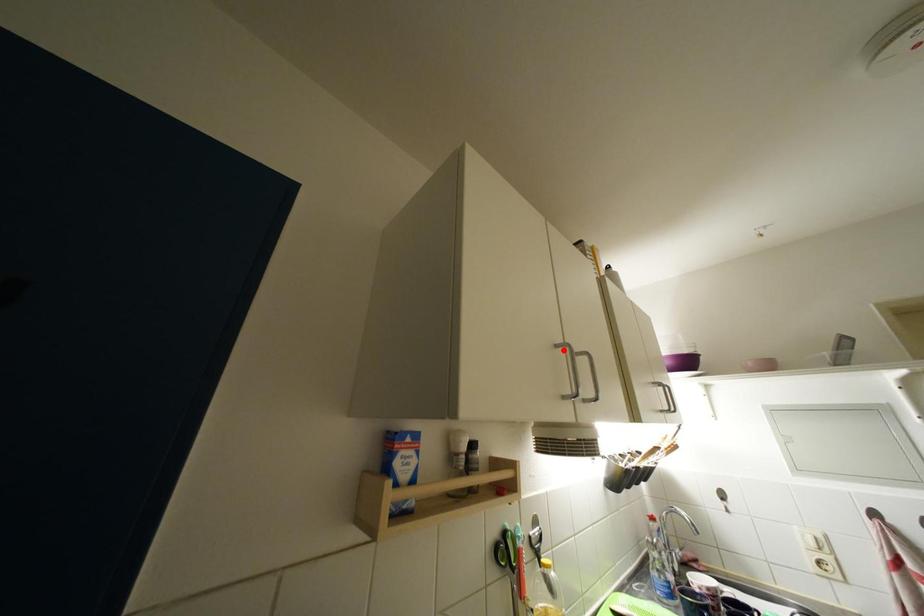
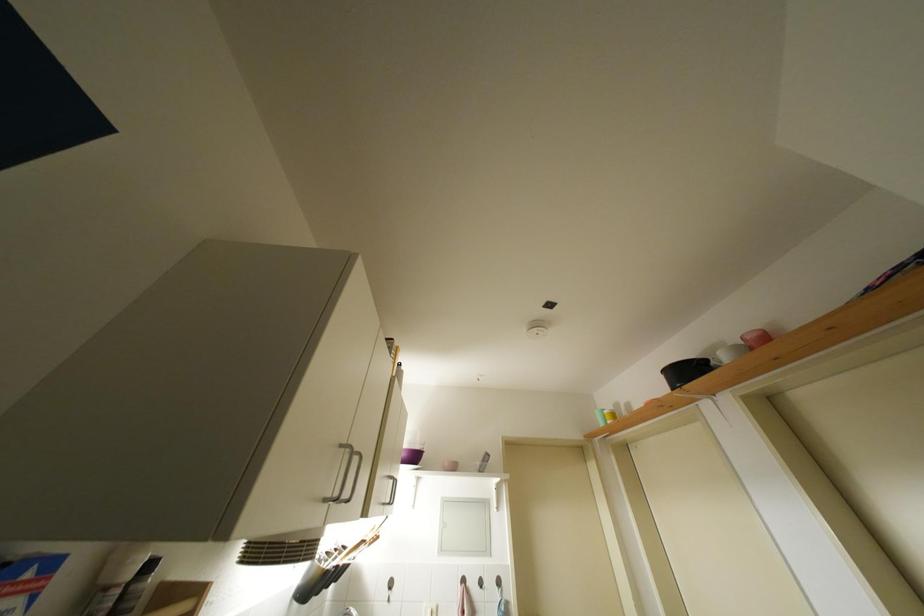
The point at the highlighted location is marked in the first image. Where is the corresponding point in the second image?

(347, 450)